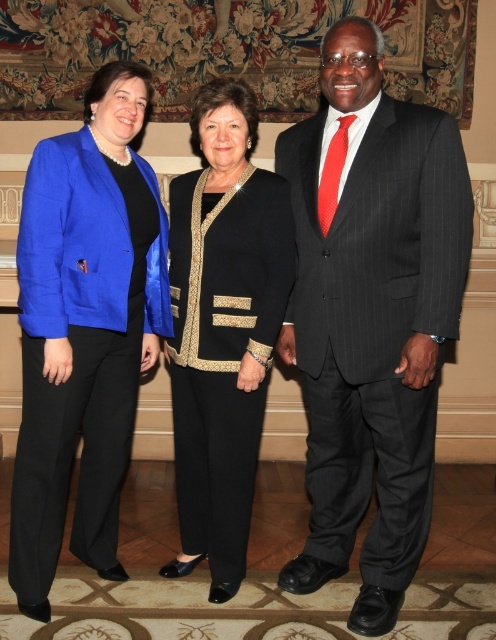
You are a photographer setting up for a group photo. You need to ensure that the matte blue blazer at left and the black textured pants at center are both in focus. Which object should you adjust your camera focus on first to ensure both are sharp?

The matte blue blazer at left is closer to the viewer than the black textured pants at center. To ensure both are in focus, you should focus on the matte blue blazer at left first, as it is nearer, and the depth of field will naturally extend to the farther object.

You are a photographer setting up for a group photo. You need to ensure that the matte blue blazer at left is visible above the black textured pants at center. Based on the scene description, is this currently achievable?

The matte blue blazer at left is located below the black textured pants at center, so it is not currently visible above them. Adjust their positions or have the person lower the blazer to ensure visibility.